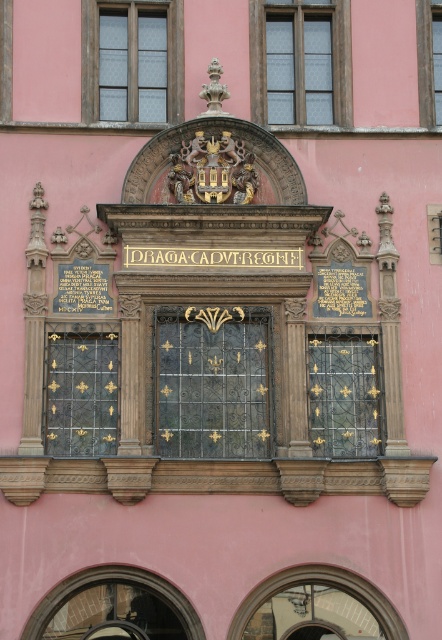
Is clear glass window at upper left bigger than clear glass window at upper center?

Indeed, clear glass window at upper left has a larger size compared to clear glass window at upper center.

Who is positioned more to the left, clear glass window at upper left or clear glass window at upper center?

clear glass window at upper left is more to the left.

Describe the element at coordinates (132, 60) in the screenshot. Image resolution: width=442 pixels, height=640 pixels. I see `clear glass window at upper left` at that location.

Where is `clear glass window at upper left`? The height and width of the screenshot is (640, 442). clear glass window at upper left is located at coordinates (132, 60).

Is clear glass window at upper left to the left of polished brass grille at center left from the viewer's perspective?

No, clear glass window at upper left is not to the left of polished brass grille at center left.

Which is in front, point (167, 61) or point (60, 428)?

Positioned in front is point (60, 428).

In the scene shown: Who is more forward, (102, 77) or (60, 419)?

Point (60, 419)

This screenshot has height=640, width=442. In order to click on clear glass window at upper left in this screenshot , I will do `click(132, 60)`.

Is clear glass window at upper left below black wrought iron window at center?

No.

What do you see at coordinates (132, 60) in the screenshot?
I see `clear glass window at upper left` at bounding box center [132, 60].

Where is `clear glass window at upper left`? This screenshot has width=442, height=640. clear glass window at upper left is located at coordinates (132, 60).